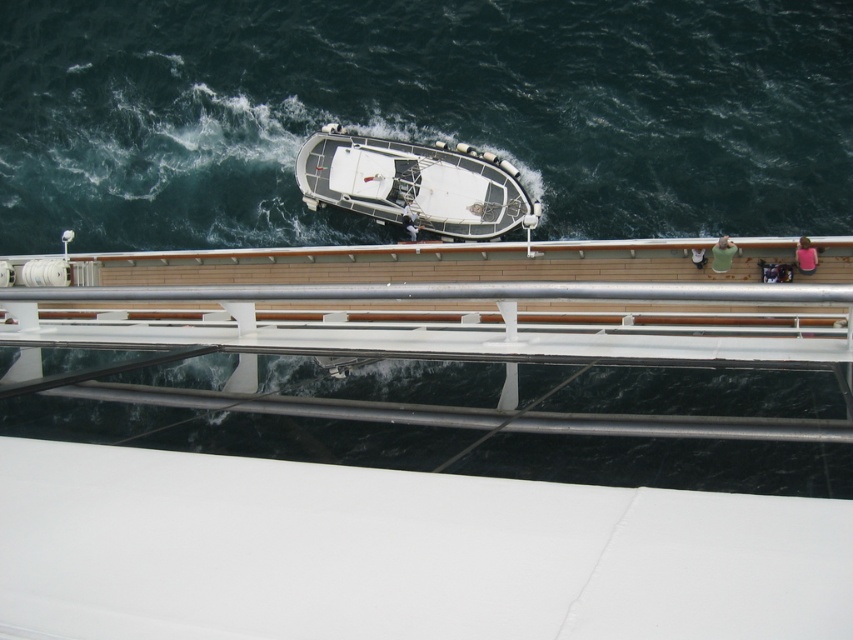
Question: Considering the real-world distances, which object is farthest from the dark blue water at center?

Choices:
 (A) green fabric person at right
 (B) white matte boat at center
 (C) pink fabric at upper right

Answer: (C)

Question: Which of the following is the farthest from the observer?

Choices:
 (A) green fabric person at right
 (B) white matte boat at center

Answer: (B)

Question: Is dark blue water at center below green fabric person at right?

Choices:
 (A) yes
 (B) no

Answer: (B)

Question: Observing the image, what is the correct spatial positioning of dark blue water at center in reference to pink fabric at upper right?

Choices:
 (A) above
 (B) below

Answer: (A)

Question: Is green fabric person at right to the left of pink fabric at upper right from the viewer's perspective?

Choices:
 (A) no
 (B) yes

Answer: (B)

Question: Among these points, which one is nearest to the camera?

Choices:
 (A) pos(717,250)
 (B) pos(805,259)
 (C) pos(329,157)

Answer: (B)